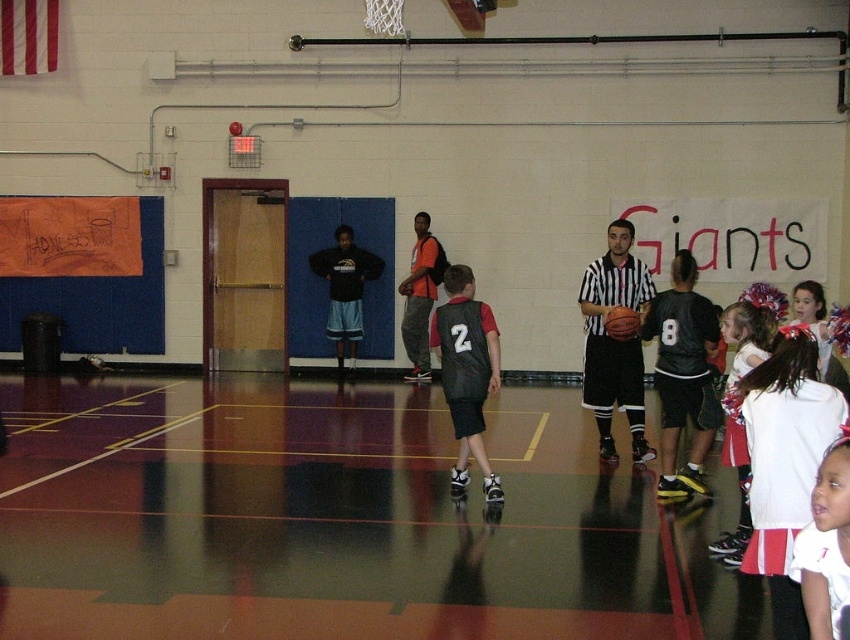
You are a spectator at the gymnasium and want to take a photo of the white jersey at lower right and the rubber textured basketball at center. Which object should you focus on first if you want to capture both in the same frame without moving the camera?

The white jersey at lower right is much taller than the rubber textured basketball at center, so you should focus on the white jersey at lower right first to ensure it fits within the frame.

You are a spectator sitting at the edge of the gymnasium court. You notice both the striped jersey referee at center and the rubber textured basketball at center. Which object is closer to you?

The striped jersey referee at center is closer to the viewer than the rubber textured basketball at center.